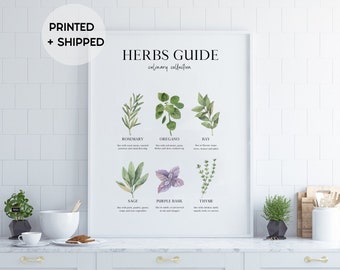
Locate an element on the screen. Image resolution: width=340 pixels, height=270 pixels. handles is located at coordinates (315, 259), (170, 258), (35, 260).